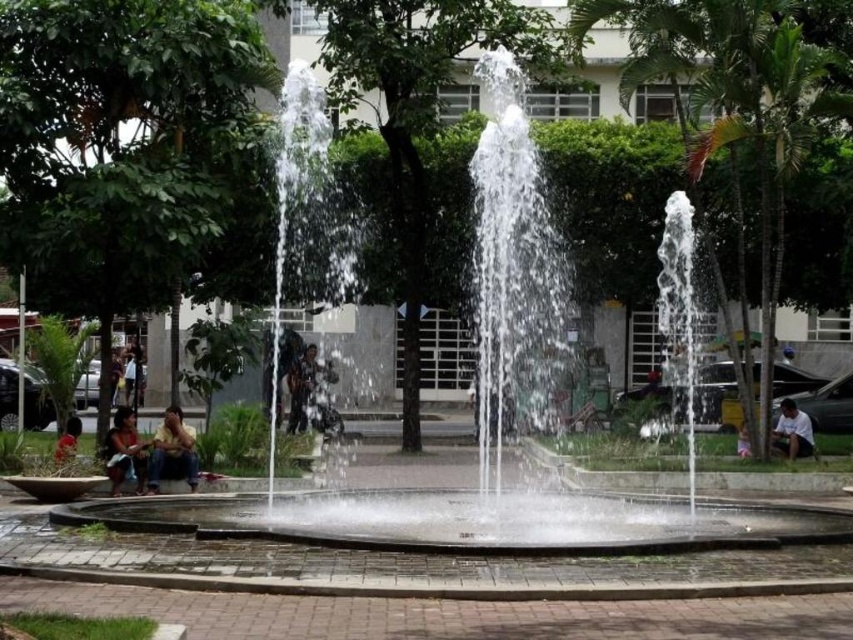
You are standing at the origin point of the coordinate system in the park scene. You need to locate the dark brown leather jacket at center. What are its coordinates?

The dark brown leather jacket at center is located at coordinates (305, 385).